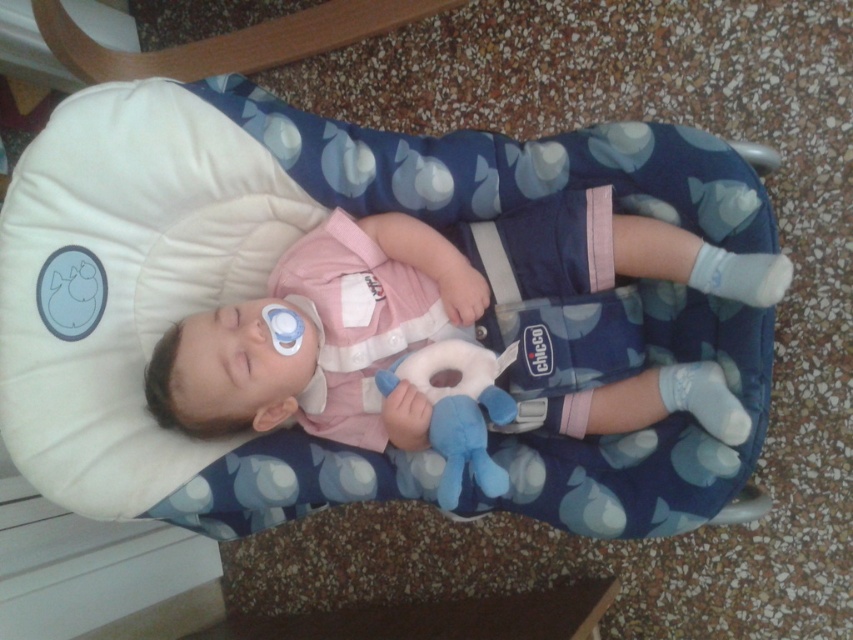
Who is higher up, blue fabric infant bed at center or pink fabric baby at center?

blue fabric infant bed at center

Between blue fabric infant bed at center and pink fabric baby at center, which one appears on the left side from the viewer's perspective?

From the viewer's perspective, blue fabric infant bed at center appears more on the left side.

What do you see at coordinates (258, 272) in the screenshot? The width and height of the screenshot is (853, 640). I see `blue fabric infant bed at center` at bounding box center [258, 272].

Where is `blue fabric infant bed at center`? This screenshot has width=853, height=640. blue fabric infant bed at center is located at coordinates (258, 272).

Does blue fabric infant bed at center have a lesser width compared to soft plush toy at center?

No.

You are a GUI agent. You are given a task and a screenshot of the screen. Output one action in this format:
    pyautogui.click(x=<x>, y=<y>)
    Task: Click on the blue fabric infant bed at center
    This screenshot has height=640, width=853.
    Given the screenshot: What is the action you would take?
    [258, 272]

Which of these two, pink fabric baby at center or soft plush toy at center, stands shorter?

Standing shorter between the two is soft plush toy at center.

Based on the photo, is pink fabric baby at center closer to camera compared to soft plush toy at center?

That is True.

Which is behind, point (329, 364) or point (483, 406)?

Positioned behind is point (329, 364).

At what (x,y) coordinates should I click in order to perform the action: click on pink fabric baby at center. Please return your answer as a coordinate pair (x, y). Looking at the image, I should click on (407, 312).